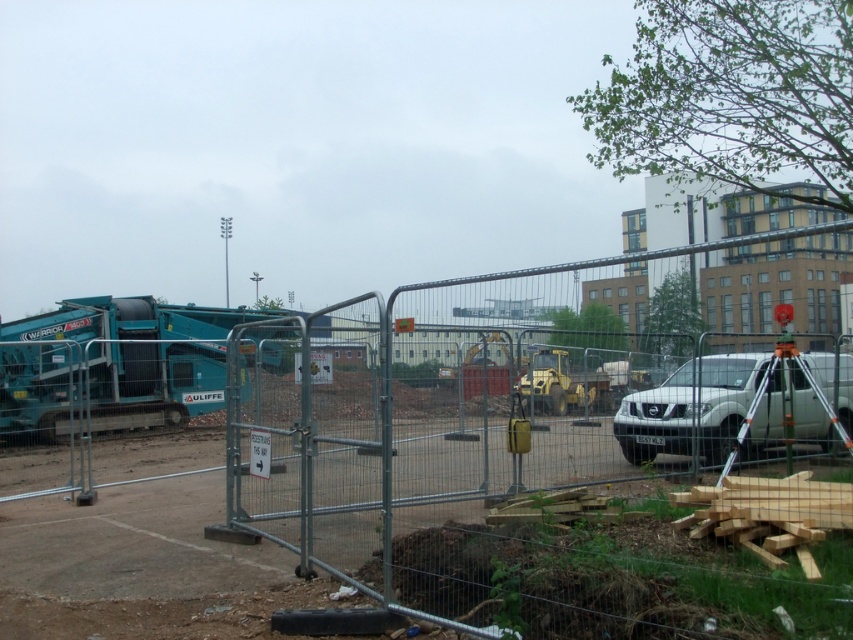
You are a delivery driver arriving at the construction site. You need to park your white matte suv at center in a spot that is not blocked by the metal fence at center. Can you park your vehicle there?

The metal fence at center might be wider than white matte suv at center, so there is a possibility that the fence is blocking the parking spot. You should check the width of the fence before deciding to park.

In the scene shown: You are standing at the entrance of the construction site and need to locate two points marked on the fence. The first point is at coordinate point (83, 312) and the second is at point (679, 432). Which point is closer to you?

Point (83, 312) is closer to you because it is further to the viewer than point (679, 432).

You are standing at the point labeled point at (131, 417). You need to walk to the white Nissan NV200. The construction site has a 70 feet wide safety zone around all heavy machinery. Is the white Nissan NV200 within the safety zone?

The distance between point at (131, 417) and the white Nissan NV200 is 74.31 feet, which exceeds the 70 feet safety zone. Therefore, the white Nissan NV200 is outside the safety zone.